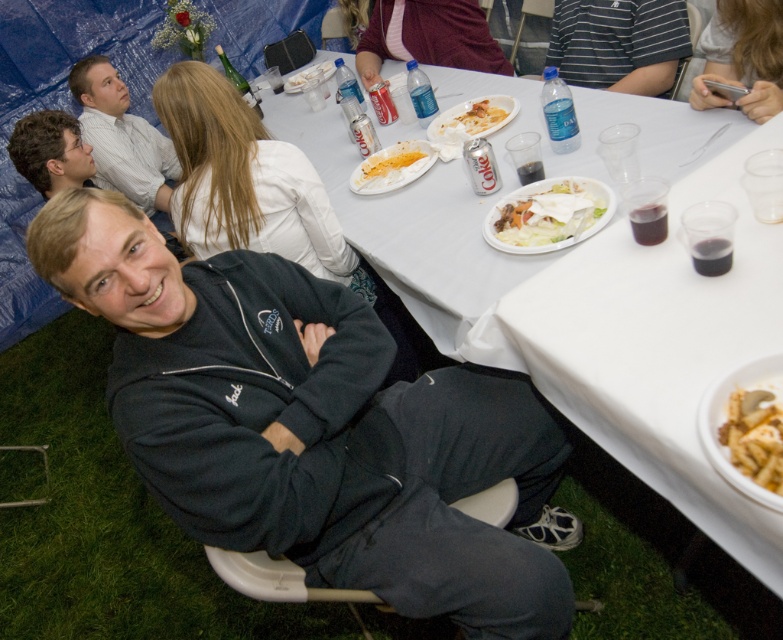
I want to click on light brown shirt at upper left, so click(121, 136).

Can you confirm if light brown shirt at upper left is positioned to the right of white plastic plate at upper center?

No, light brown shirt at upper left is not to the right of white plastic plate at upper center.

Is point (80, 68) farther from viewer compared to point (493, 124)?

Yes, point (80, 68) is behind point (493, 124).

You are a GUI agent. You are given a task and a screenshot of the screen. Output one action in this format:
    pyautogui.click(x=<x>, y=<y>)
    Task: Click on the light brown shirt at upper left
    The image size is (783, 640).
    Given the screenshot: What is the action you would take?
    pyautogui.click(x=121, y=136)

Who is more forward, (637, 60) or (549, 182)?

Point (549, 182) is more forward.

Which is more to the right, striped shirt at upper right or white creamy pasta at center?

Positioned to the right is striped shirt at upper right.

The height and width of the screenshot is (640, 783). What are the coordinates of `striped shirt at upper right` in the screenshot? It's located at (619, 44).

Can you confirm if dark gray sweatshirt at center is bigger than yellowish matte pasta at center?

Yes, dark gray sweatshirt at center is bigger than yellowish matte pasta at center.

Can you confirm if dark gray sweatshirt at center is shorter than yellowish matte pasta at center?

In fact, dark gray sweatshirt at center may be taller than yellowish matte pasta at center.

Does point (385, 323) come farther from viewer compared to point (421, 157)?

Yes, point (385, 323) is behind point (421, 157).

Find the location of a particular element. This screenshot has width=783, height=640. dark gray sweatshirt at center is located at coordinates (255, 192).